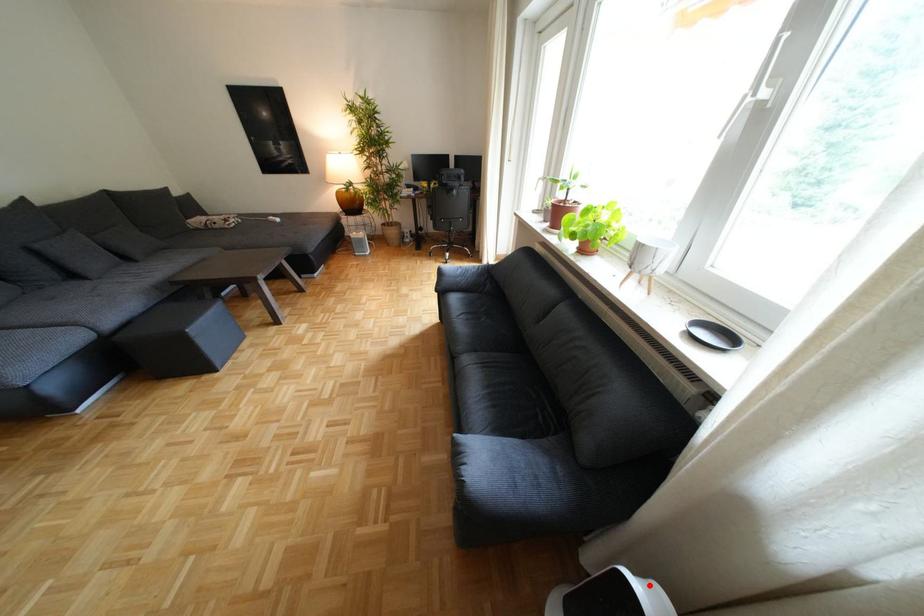
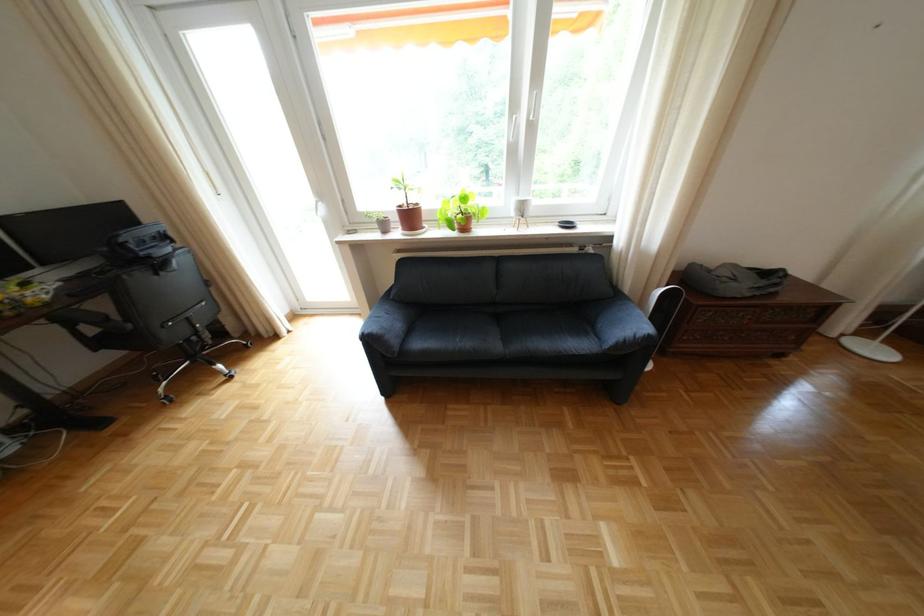
In the second image, find the point that corresponds to the highlighted location in the first image.

(682, 286)